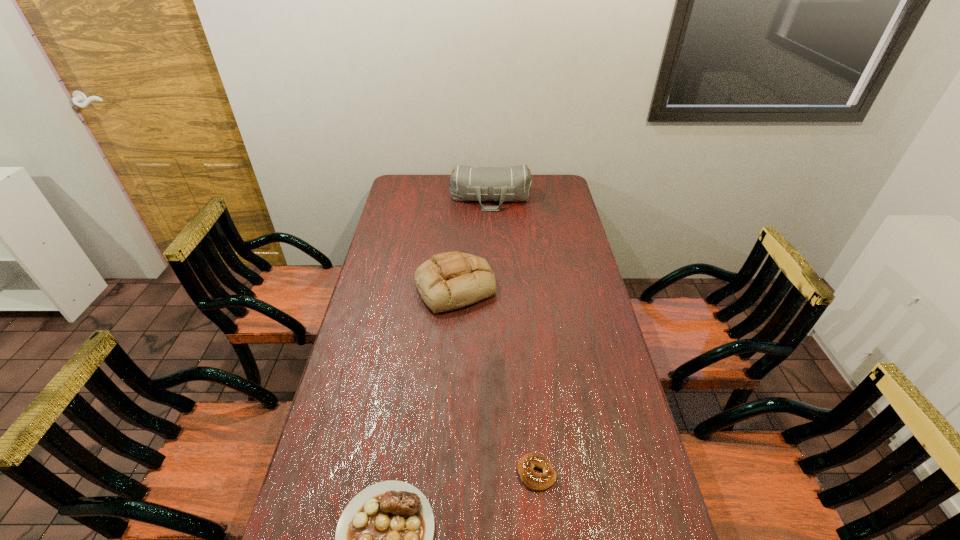
Identify which object is the third closest to the duffel bag. Please provide its 2D coordinates. Your answer should be formatted as a tuple, i.e. [(x, y)], where the tuple contains the x and y coordinates of a point satisfying the conditions above.

[(384, 538)]

Where is `vacant space that satisfies the following two spatial constraints: 1. on the front side of the farthest object; 2. on the left side of the bagel`? This screenshot has height=540, width=960. vacant space that satisfies the following two spatial constraints: 1. on the front side of the farthest object; 2. on the left side of the bagel is located at coordinates pyautogui.click(x=500, y=473).

Where is `vacant space that satisfies the following two spatial constraints: 1. on the back side of the second tallest object; 2. on the right side of the farthest object`? vacant space that satisfies the following two spatial constraints: 1. on the back side of the second tallest object; 2. on the right side of the farthest object is located at coordinates click(461, 199).